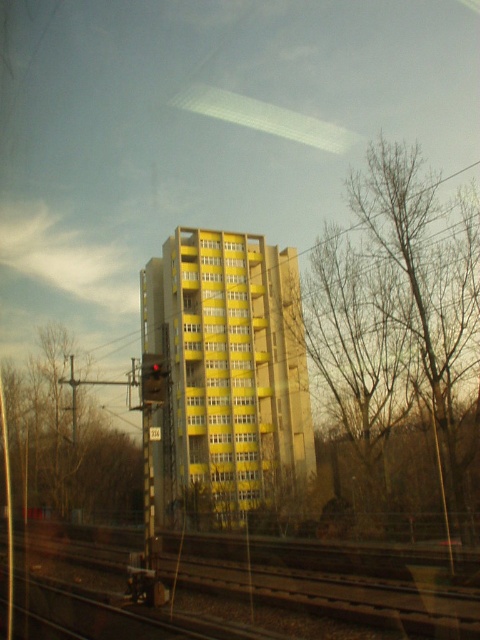
You are a passenger on the train and you see the bare wood tree at right and the red glass traffic light at center. How far apart are these two objects from each other?

The bare wood tree at right is 12.27 meters from red glass traffic light at center.

You are a passenger on the train and looking out the window. You see a bare wood tree at right and a brown gravel train track at lower left. Which object appears thinner from your perspective?

The bare wood tree at right appears thinner than the brown gravel train track at lower left.

You are a passenger on the train and notice the bare wood tree at right and the red glass traffic light at center outside the window. Which object appears larger in the window?

The bare wood tree at right appears larger than the red glass traffic light at center because it is bigger in size according to the description.